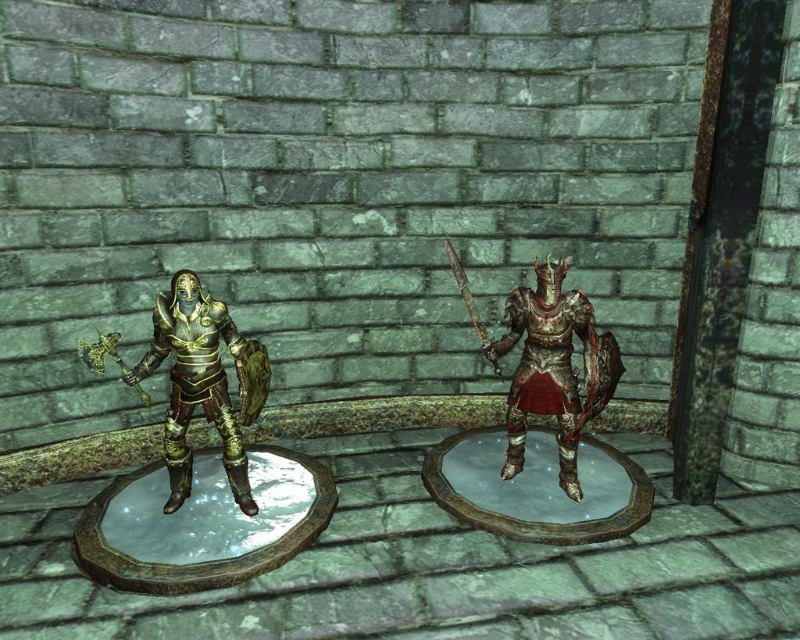
You are a game developer trying to place a new treasure chest in the scene. The treasure chest must be placed exactly at point (202, 381). What object is located at that point?

The point (202, 381) corresponds to the gold plated armor at left.

You are a game developer designing a level where two armored characters are positioned on platforms. The gold plated armor at left and polished bronze armor at center are separated by a gap. If the game requires the gap between them to be at least 3 feet to allow players to jump between platforms, will the current distance of 30.86 inches suffice?

The gap between the gold plated armor at left and the polished bronze armor at center is 30.86 inches. Since 3 feet equals 36 inches, the current distance of 30.86 inches is shorter than the required 36 inches. Therefore, the gap is not sufficient for players to jump between platforms.